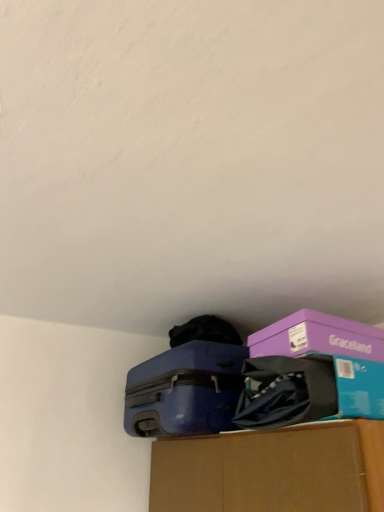
Question: Is matte purple storage box at center inside matte blue suitcase at center?

Choices:
 (A) yes
 (B) no

Answer: (B)

Question: Considering the relative positions of matte blue suitcase at center and matte purple storage box at center in the image provided, is matte blue suitcase at center to the right of matte purple storage box at center from the viewer's perspective?

Choices:
 (A) yes
 (B) no

Answer: (B)

Question: Is matte blue suitcase at center aimed at matte purple storage box at center?

Choices:
 (A) yes
 (B) no

Answer: (B)

Question: From the image's perspective, is matte blue suitcase at center below matte purple storage box at center?

Choices:
 (A) yes
 (B) no

Answer: (A)

Question: From a real-world perspective, is matte blue suitcase at center beneath matte purple storage box at center?

Choices:
 (A) yes
 (B) no

Answer: (B)

Question: Considering the positions of purple cardboard box at upper right and matte purple storage box at center in the image, is purple cardboard box at upper right wider or thinner than matte purple storage box at center?

Choices:
 (A) wide
 (B) thin

Answer: (B)

Question: Is purple cardboard box at upper right situated inside matte purple storage box at center or outside?

Choices:
 (A) inside
 (B) outside

Answer: (B)

Question: Considering the positions of purple cardboard box at upper right and matte purple storage box at center in the image, is purple cardboard box at upper right bigger or smaller than matte purple storage box at center?

Choices:
 (A) big
 (B) small

Answer: (B)

Question: In the image, is purple cardboard box at upper right on the left side or the right side of matte purple storage box at center?

Choices:
 (A) right
 (B) left

Answer: (B)

Question: From the image's perspective, is purple cardboard box at upper right above or below matte blue suitcase at center?

Choices:
 (A) above
 (B) below

Answer: (A)

Question: Considering the positions of purple cardboard box at upper right and matte blue suitcase at center in the image, is purple cardboard box at upper right bigger or smaller than matte blue suitcase at center?

Choices:
 (A) small
 (B) big

Answer: (A)

Question: In the image, is purple cardboard box at upper right on the left side or the right side of matte blue suitcase at center?

Choices:
 (A) left
 (B) right

Answer: (B)

Question: In terms of height, does purple cardboard box at upper right look taller or shorter compared to matte blue suitcase at center?

Choices:
 (A) short
 (B) tall

Answer: (A)

Question: In the image, is matte purple storage box at center positioned in front of or behind matte blue suitcase at center?

Choices:
 (A) behind
 (B) front

Answer: (B)

Question: In terms of height, does matte purple storage box at center look taller or shorter compared to matte blue suitcase at center?

Choices:
 (A) short
 (B) tall

Answer: (A)